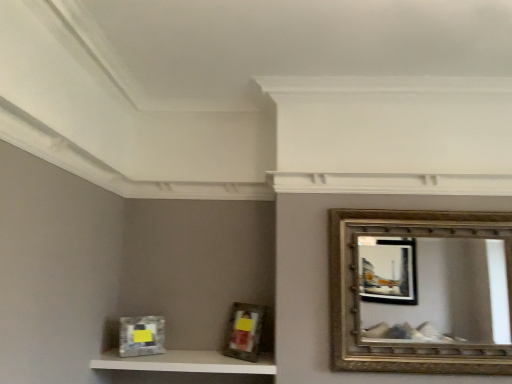
Question: Is metallic silver picture frame at lower left, the first picture frame from the left, not near white textured shelf at lower left?

Choices:
 (A) no
 (B) yes

Answer: (A)

Question: From the image's perspective, does metallic silver picture frame at lower left, the first picture frame from the left, appear higher than white textured shelf at lower left?

Choices:
 (A) yes
 (B) no

Answer: (A)

Question: Is metallic silver picture frame at lower left, the second picture frame positioned from the right, smaller than white textured shelf at lower left?

Choices:
 (A) yes
 (B) no

Answer: (A)

Question: Is metallic silver picture frame at lower left, the first picture frame from the left, taller than white textured shelf at lower left?

Choices:
 (A) yes
 (B) no

Answer: (A)

Question: Does metallic silver picture frame at lower left, the first picture frame from the left, have a larger size compared to white textured shelf at lower left?

Choices:
 (A) yes
 (B) no

Answer: (B)

Question: Considering the positions of white textured shelf at lower left and metallic silver picture frame at lower left, the first picture frame from the left, in the image, is white textured shelf at lower left wider or thinner than metallic silver picture frame at lower left, the first picture frame from the left,?

Choices:
 (A) thin
 (B) wide

Answer: (B)

Question: Based on their sizes in the image, would you say white textured shelf at lower left is bigger or smaller than metallic silver picture frame at lower left, the second picture frame positioned from the right?

Choices:
 (A) big
 (B) small

Answer: (A)

Question: From their relative heights in the image, would you say white textured shelf at lower left is taller or shorter than metallic silver picture frame at lower left, the first picture frame from the left?

Choices:
 (A) short
 (B) tall

Answer: (A)

Question: Does point (141, 355) appear closer or farther from the camera than point (163, 322)?

Choices:
 (A) farther
 (B) closer

Answer: (B)

Question: Is white textured shelf at lower left in front of or behind matte silver picture frame at center, placed as the second picture frame when sorted from left to right, in the image?

Choices:
 (A) front
 (B) behind

Answer: (A)

Question: Considering the relative positions of white textured shelf at lower left and matte silver picture frame at center, placed as the second picture frame when sorted from left to right, in the image provided, is white textured shelf at lower left to the left or to the right of matte silver picture frame at center, placed as the second picture frame when sorted from left to right,?

Choices:
 (A) left
 (B) right

Answer: (A)

Question: From their relative heights in the image, would you say white textured shelf at lower left is taller or shorter than matte silver picture frame at center, placed as the second picture frame when sorted from left to right?

Choices:
 (A) tall
 (B) short

Answer: (B)

Question: From a real-world perspective, is white textured shelf at lower left positioned above or below matte silver picture frame at center, placed as the second picture frame when sorted from left to right?

Choices:
 (A) below
 (B) above

Answer: (A)

Question: From a real-world perspective, is gold textured mirror at upper right physically located above or below metallic silver picture frame at lower left, the first picture frame from the left?

Choices:
 (A) below
 (B) above

Answer: (B)

Question: Based on their positions, is gold textured mirror at upper right located to the left or right of metallic silver picture frame at lower left, the first picture frame from the left?

Choices:
 (A) right
 (B) left

Answer: (A)